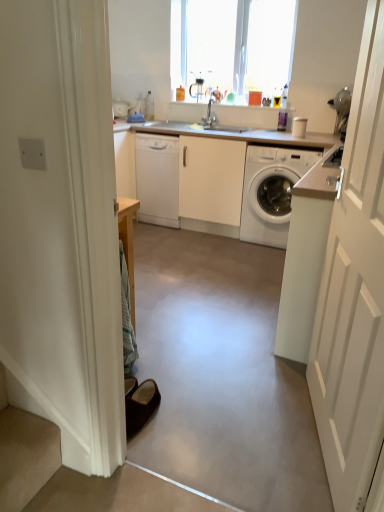
Find the location of `free location in front of brown suede slippers at lower left`. free location in front of brown suede slippers at lower left is located at coordinates (157, 445).